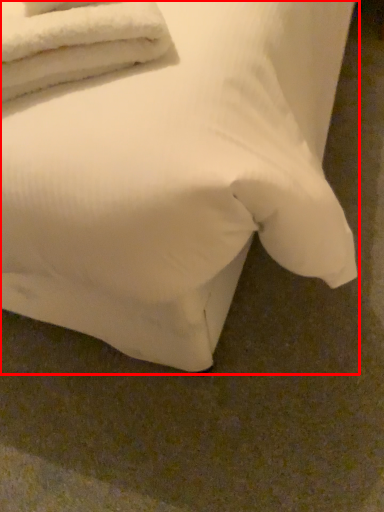
Question: Observing the image, what is the correct spatial positioning of bed (annotated by the red box) in reference to towel?

Choices:
 (A) right
 (B) left

Answer: (A)